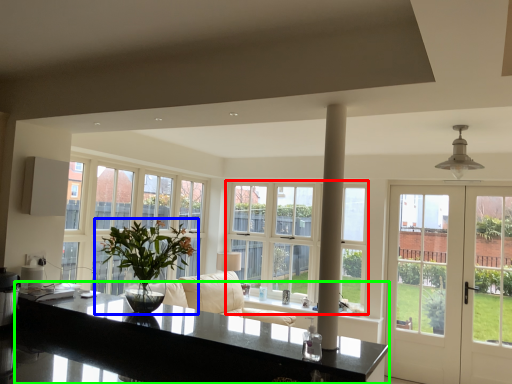
Question: Which object is the closest to the window (highlighted by a red box)? Choose among these: houseplant (highlighted by a blue box) or countertop (highlighted by a green box).

Choices:
 (A) houseplant
 (B) countertop

Answer: (A)